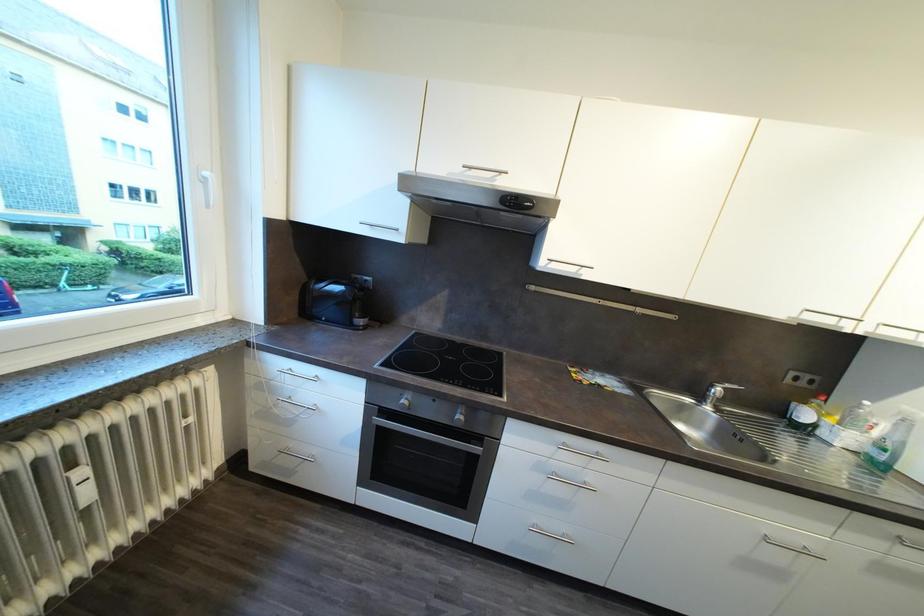
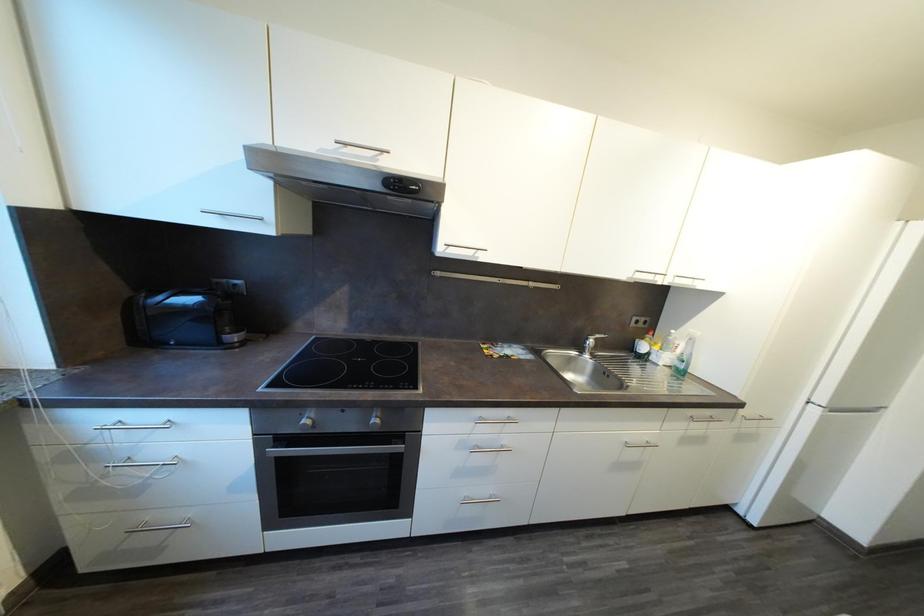
Question: How did the camera likely rotate?

Choices:
 (A) Left
 (B) Right
 (C) Up
 (D) Down

Answer: (B)